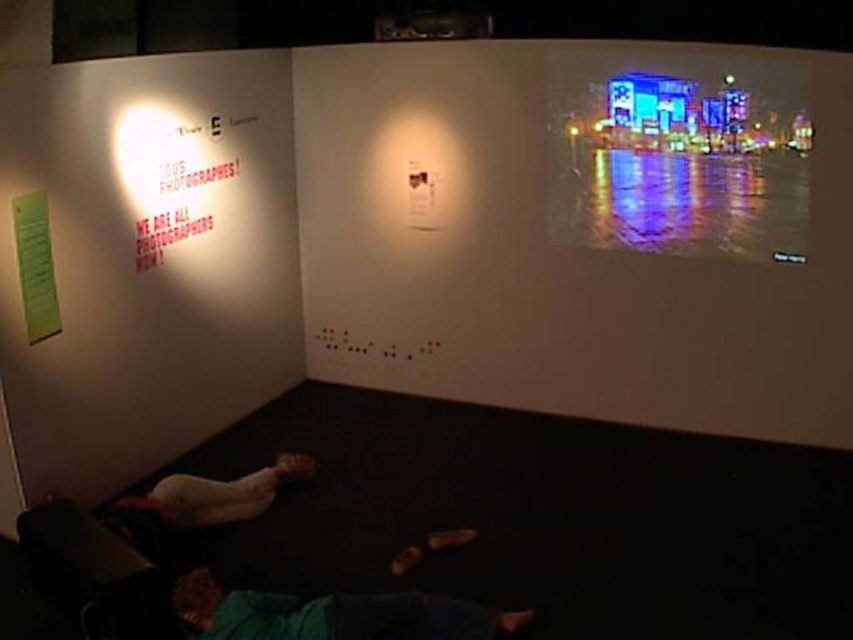
In the scene shown: You are standing in the gallery and want to take a photo of the smooth skin person at lower center without the reflective glass cityscape at upper right appearing in the frame. Is this possible?

The reflective glass cityscape at upper right is positioned over the smooth skin person at lower center, so it would be difficult to capture the person without the cityscape appearing in the frame.

You are standing in the gallery and want to take a photo of the smooth skin person at lower center without the green fabric pants at lower center blocking the view. Is this possible?

The green fabric pants at lower center is in front of the smooth skin person at lower center, so it will block the view. You cannot take a photo of the smooth skin person at lower center without the green fabric pants at lower center blocking the view.

You are an artist in the gallery and want to take a photo of the green fabric pants at lower center without the reflective glass cityscape at upper right appearing in the shot. Is this possible?

The green fabric pants at lower center is behind the reflective glass cityscape at upper right, so it is not possible to capture the green fabric pants at lower center without the reflective glass cityscape at upper right appearing in the shot.